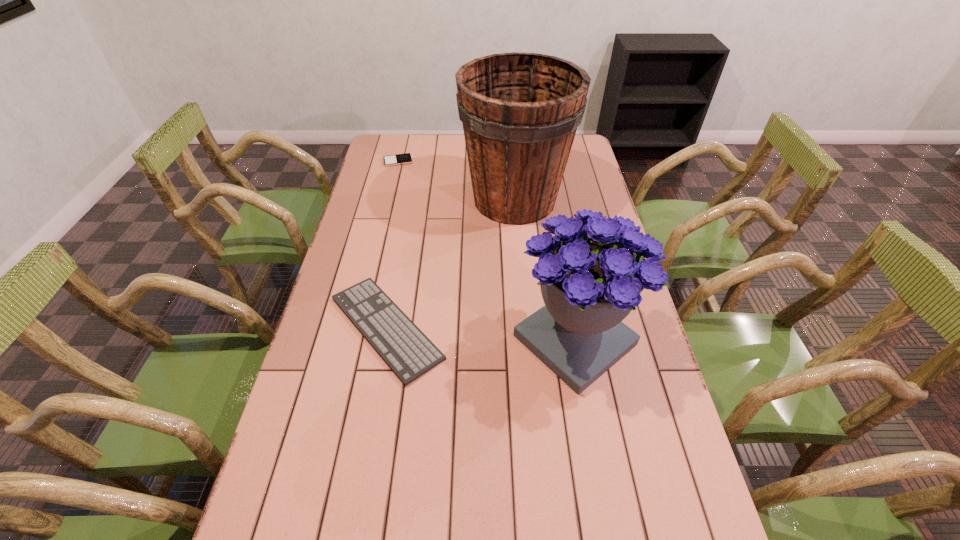
The image size is (960, 540). Find the location of `the second farthest object`. the second farthest object is located at coordinates (520, 111).

Image resolution: width=960 pixels, height=540 pixels. I want to click on bouquet, so click(x=591, y=273).

At what (x,y) coordinates should I click in order to perform the action: click on the second shortest object. Please return your answer as a coordinate pair (x, y). Looking at the image, I should click on (409, 353).

Identify the location of the shortest object. (399, 159).

Image resolution: width=960 pixels, height=540 pixels. What are the coordinates of `the farthest object` in the screenshot? It's located at (399, 159).

Locate an element on the screen. The width and height of the screenshot is (960, 540). vacant region located 0.270m on the left of the third nearest object is located at coordinates (387, 200).

Where is `free space located 0.330m on the left of the bouquet`? Image resolution: width=960 pixels, height=540 pixels. free space located 0.330m on the left of the bouquet is located at coordinates (392, 340).

The image size is (960, 540). In order to click on blank space located on the back of the third tallest object in this screenshot , I will do `click(409, 205)`.

I want to click on vacant region located 0.250m on the front of the farthest object, so click(388, 204).

The height and width of the screenshot is (540, 960). Find the location of `object that is at the far edge`. object that is at the far edge is located at coordinates (399, 159).